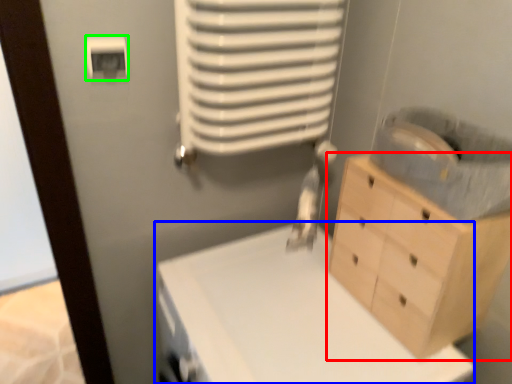
Question: Considering the real-world distances, which object is farthest from chest of drawers (highlighted by a red box)? changing table (highlighted by a blue box) or light switch (highlighted by a green box)?

Choices:
 (A) changing table
 (B) light switch

Answer: (B)